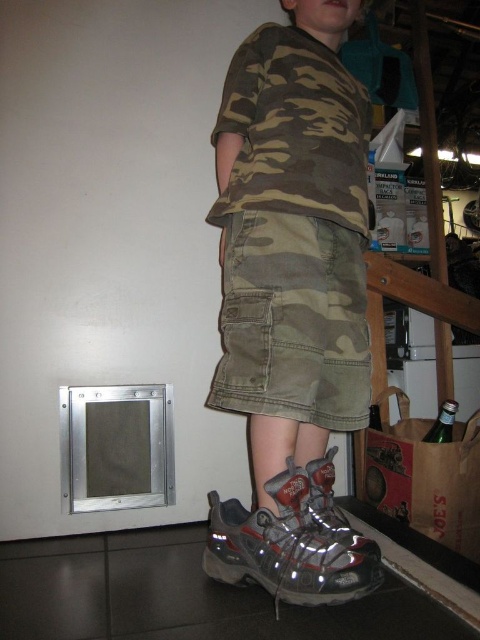
Question: Is camouflage fabric shirt at center behind metallic gray shoe at lower center?

Choices:
 (A) no
 (B) yes

Answer: (B)

Question: Is camouflage fabric shirt at center to the right of metallic gray shoe at lower center from the viewer's perspective?

Choices:
 (A) yes
 (B) no

Answer: (A)

Question: Which point is farther to the camera?

Choices:
 (A) (211, 515)
 (B) (321, 387)

Answer: (B)

Question: Is camouflage fabric shirt at center thinner than metallic gray shoe at lower center?

Choices:
 (A) yes
 (B) no

Answer: (B)